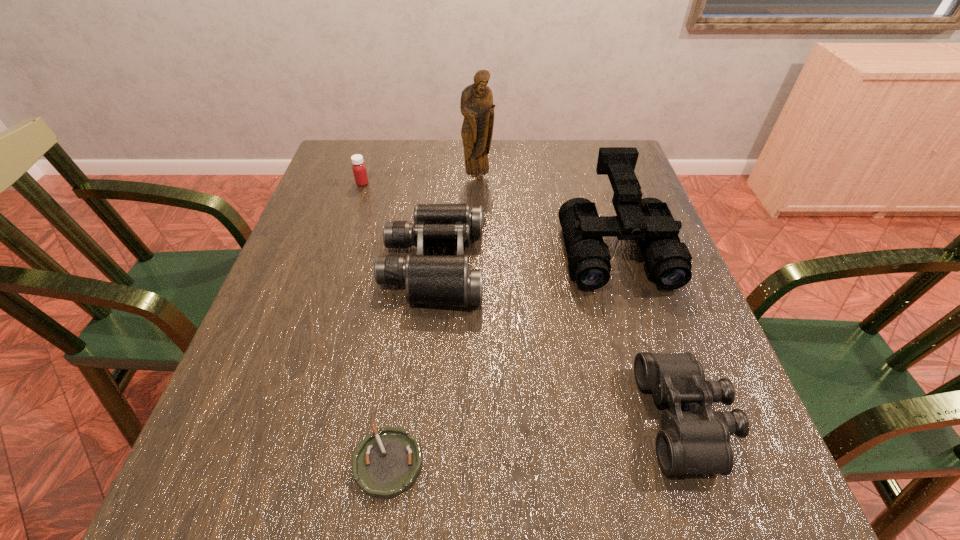
The height and width of the screenshot is (540, 960). Identify the location of object that is positioned at the far left corner. (359, 169).

The width and height of the screenshot is (960, 540). In order to click on object positioned at the near right corner in this screenshot , I will do `click(698, 442)`.

The image size is (960, 540). In the image, there is a desktop. In order to click on vacant space at the far edge in this screenshot , I will do `click(427, 164)`.

At what (x,y) coordinates should I click in order to perform the action: click on free space at the near edge of the desktop. Please return your answer as a coordinate pair (x, y). Looking at the image, I should click on (585, 494).

The height and width of the screenshot is (540, 960). In the image, there is a desktop. In order to click on vacant space at the left edge in this screenshot , I will do `click(321, 206)`.

In order to click on vacant space at the right edge of the desktop in this screenshot , I will do `click(630, 284)`.

Locate an element on the screen. vacant point at the far left corner is located at coordinates (341, 143).

In the image, there is a desktop. At what (x,y) coordinates should I click in order to perform the action: click on vacant region at the near left corner. Please return your answer as a coordinate pair (x, y). Looking at the image, I should click on (222, 527).

Locate an element on the screen. This screenshot has width=960, height=540. vacant space at the far right corner is located at coordinates (587, 156).

This screenshot has width=960, height=540. I want to click on vacant area that lies between the leftmost binoculars and the shortest binoculars, so tap(560, 341).